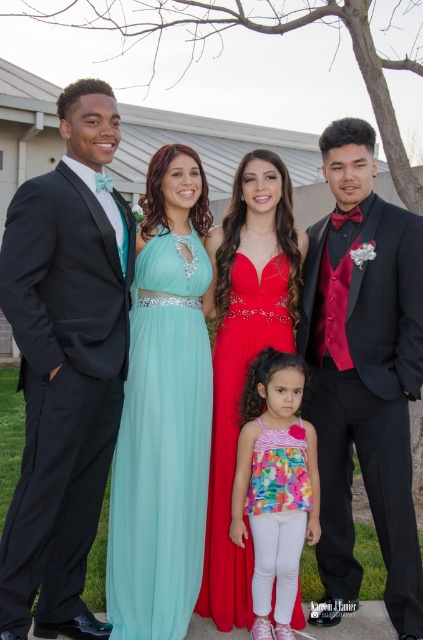
Is point (395, 525) positioned after point (258, 401)?

No.

Who is more distant from viewer, [395,276] or [280,602]?

The point [395,276] is more distant.

The height and width of the screenshot is (640, 423). In order to click on black satin suit at right in this screenshot , I will do `click(362, 374)`.

Does shiny black suit at left appear under shiny red dress at center?

Actually, shiny black suit at left is above shiny red dress at center.

Is shiny black suit at left shorter than shiny red dress at center?

In fact, shiny black suit at left may be taller than shiny red dress at center.

Is point (68, 232) positioned before point (238, 588)?

Yes, point (68, 232) is closer to viewer.

The height and width of the screenshot is (640, 423). Find the location of `shiny black suit at left`. shiny black suit at left is located at coordinates (65, 364).

Can you confirm if black satin suit at right is wider than teal chiffon dress at center?

Yes.

Which is above, black satin suit at right or teal chiffon dress at center?

black satin suit at right

Who is more forward, (x=412, y=394) or (x=158, y=397)?

Point (x=412, y=394) is in front.

The image size is (423, 640). What are the coordinates of `black satin suit at right` in the screenshot? It's located at (362, 374).